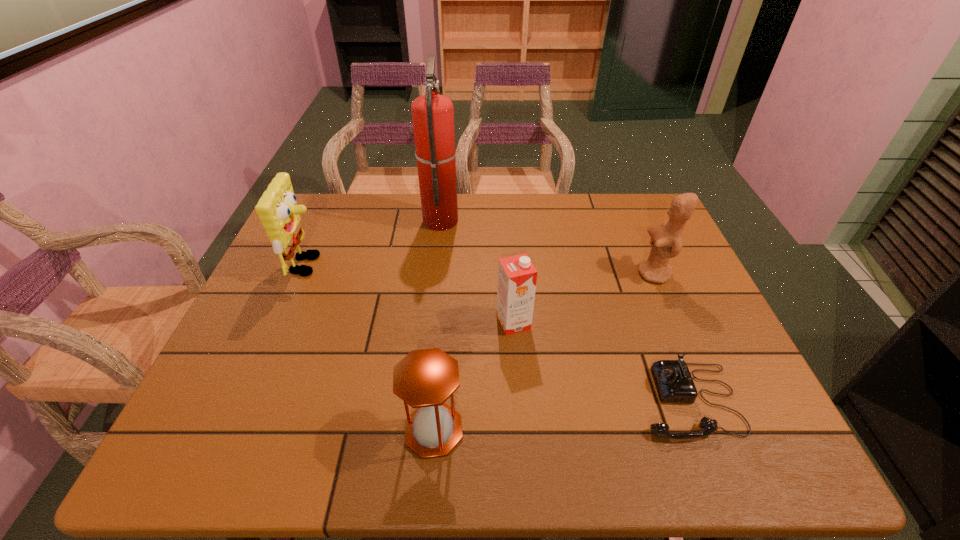
Locate an element on the screen. This screenshot has height=540, width=960. telephone positioned at the near edge is located at coordinates (674, 383).

The width and height of the screenshot is (960, 540). Find the location of `object that is at the left edge`. object that is at the left edge is located at coordinates coord(277,209).

You are a GUI agent. You are given a task and a screenshot of the screen. Output one action in this format:
    pyautogui.click(x=<x>, y=<y>)
    Task: Click on the figurine at the right edge
    
    Given the screenshot: What is the action you would take?
    pyautogui.click(x=666, y=240)

This screenshot has width=960, height=540. I want to click on telephone at the right edge, so click(674, 383).

The image size is (960, 540). I want to click on object present at the near right corner, so click(674, 383).

I want to click on free space at the far edge, so click(361, 201).

At what (x,y) coordinates should I click in order to perform the action: click on free point at the near edge. Please return your answer as a coordinate pair (x, y). Looking at the image, I should click on (539, 446).

You are a GUI agent. You are given a task and a screenshot of the screen. Output one action in this format:
    pyautogui.click(x=<x>, y=<y>)
    Task: Click on the free space at the right edge
    This screenshot has width=960, height=540.
    Given the screenshot: What is the action you would take?
    click(708, 317)

You are a GUI agent. You are given a task and a screenshot of the screen. Output one action in this format:
    pyautogui.click(x=<x>, y=<y>)
    Task: Click on the vacant space at the near left corner of the desktop
    Image resolution: width=960 pixels, height=540 pixels.
    Given the screenshot: What is the action you would take?
    pyautogui.click(x=216, y=428)

I want to click on free spot between the figurine and the telephone, so click(x=671, y=337).